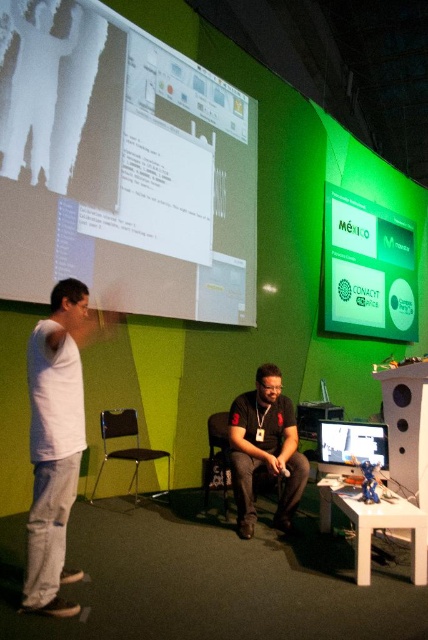
Question: Which of the following is the farthest from the observer?

Choices:
 (A) (225, 483)
 (B) (398, 237)
 (C) (356, 456)
 (D) (189, 266)

Answer: (B)

Question: Based on their relative distances, which object is farther from the green matte projection screen at upper right?

Choices:
 (A) black fabric chair at center
 (B) brown leather chair at lower left
 (C) white matte projection screen at upper left

Answer: (B)

Question: Can you confirm if black matte shirt at center is smaller than matte black monitor at center?

Choices:
 (A) no
 (B) yes

Answer: (A)

Question: Which point appears farthest from the camera in this image?

Choices:
 (A) (211, 419)
 (B) (395, 268)

Answer: (B)

Question: Can you confirm if black matte shirt at center is thinner than black fabric chair at center?

Choices:
 (A) no
 (B) yes

Answer: (A)

Question: Is black matte shirt at center wider than black fabric chair at center?

Choices:
 (A) no
 (B) yes

Answer: (B)